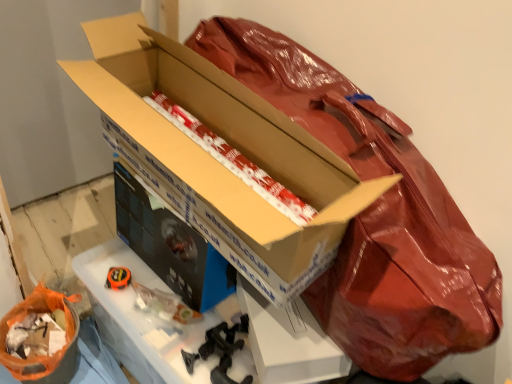
Question: In terms of height, does white/red striped paper at center, the 1th wrapping paper positioned from the right, look taller or shorter compared to black cardboard workbench at center?

Choices:
 (A) short
 (B) tall

Answer: (A)

Question: From the image's perspective, is white/red striped paper at center, the 1th wrapping paper in the top-to-bottom sequence, located above or below black cardboard workbench at center?

Choices:
 (A) below
 (B) above

Answer: (B)

Question: Estimate the real-world distances between objects in this image. Which object is farther from the white/red striped paper at center, the 1th wrapping paper positioned from the right?

Choices:
 (A) matte cardboard box at center, the first box positioned from the back
 (B) black cardboard workbench at center
 (C) cardboard box at center, which is counted as the 2th box, starting from the back
 (D) orange plastic bag at lower left, the first wrapping paper positioned from the left

Answer: (D)

Question: Which of these objects is positioned farthest from the cardboard box at center, which is counted as the 2th box, starting from the back?

Choices:
 (A) orange plastic bag at lower left, the 2th wrapping paper in the right-to-left sequence
 (B) black cardboard workbench at center
 (C) white/red striped paper at center, the 1th wrapping paper in the top-to-bottom sequence
 (D) matte cardboard box at center, arranged as the 2th box when viewed from the front

Answer: (A)